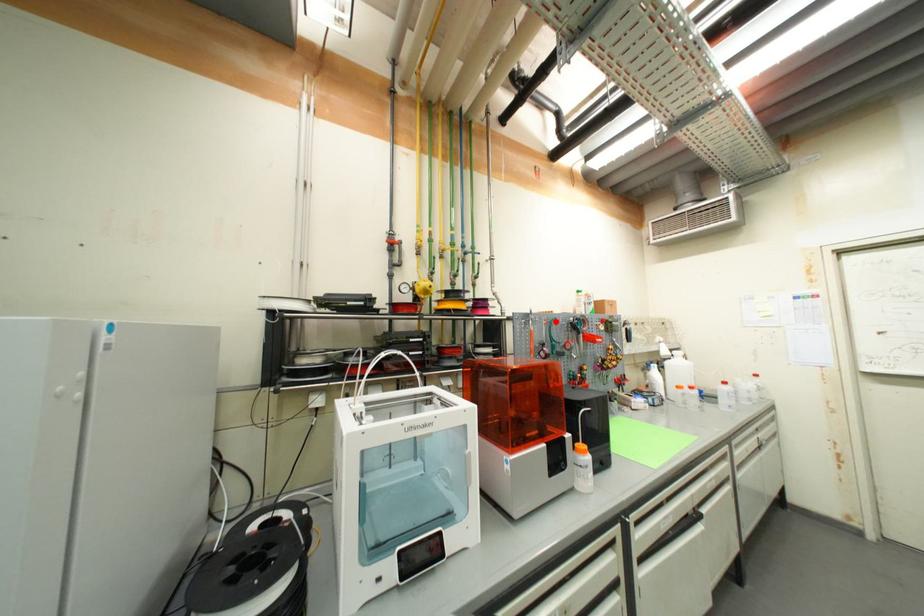
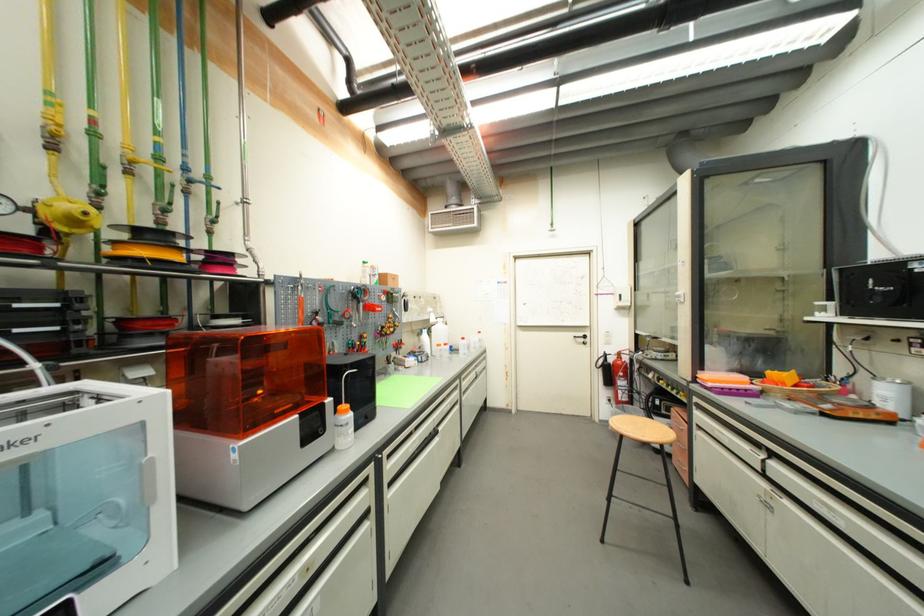
Where in the second image is the point corresponding to the highlighted location from the first image?

(334, 289)